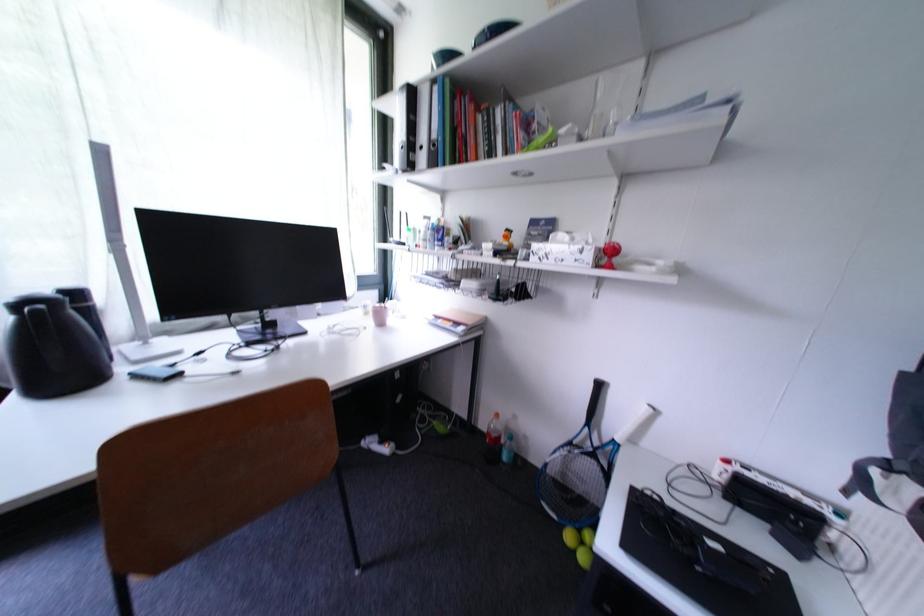
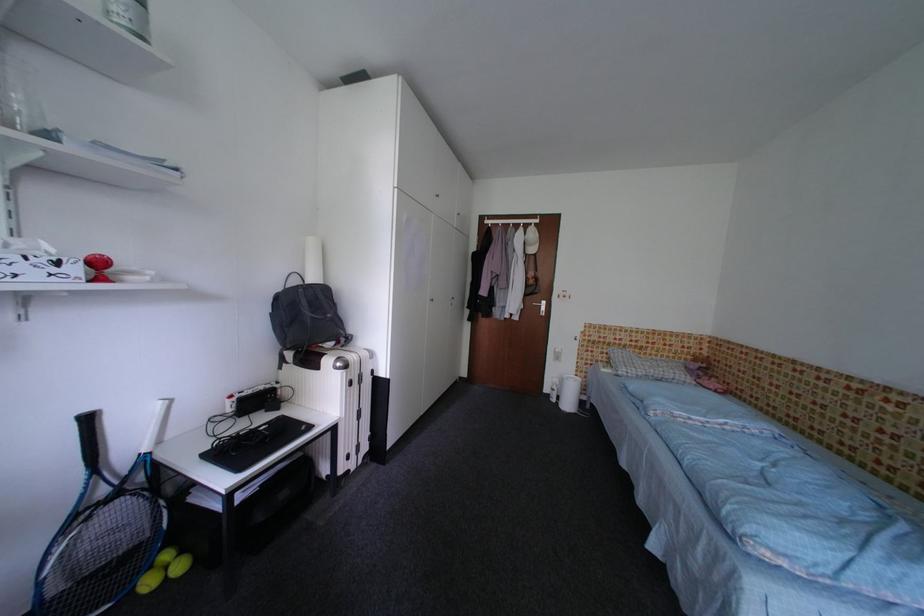
The point at (598,257) is marked in the first image. Where is the corresponding point in the second image?

(83, 272)